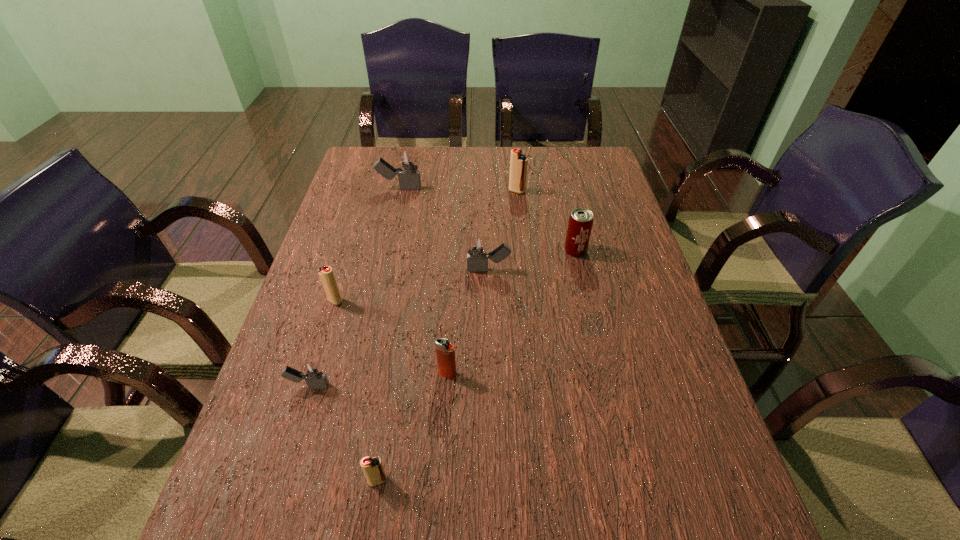
You are a GUI agent. You are given a task and a screenshot of the screen. Output one action in this format:
    pyautogui.click(x=<x>, y=<y>)
    Task: Click on the red igniter object that ranks as the closest to the nearest igniter
    
    Given the screenshot: What is the action you would take?
    pyautogui.click(x=326, y=275)

Select which red igniter is the second closest to the biggest gray igniter. Please provide its 2D coordinates. Your answer should be formatted as a tuple, i.e. [(x, y)], where the tuple contains the x and y coordinates of a point satisfying the conditions above.

[(326, 275)]

Identify the location of gray igniter that can be found as the second closest to the third farthest object. The image size is (960, 540). (409, 178).

Identify which gray igniter is the second closest to the second nearest red igniter. Please provide its 2D coordinates. Your answer should be formatted as a tuple, i.e. [(x, y)], where the tuple contains the x and y coordinates of a point satisfying the conditions above.

[(478, 252)]

The image size is (960, 540). I want to click on vacant position in the image that satisfies the following two spatial constraints: 1. on the front side of the fourth farthest igniter; 2. on the left side of the nearest gray igniter, so (x=308, y=386).